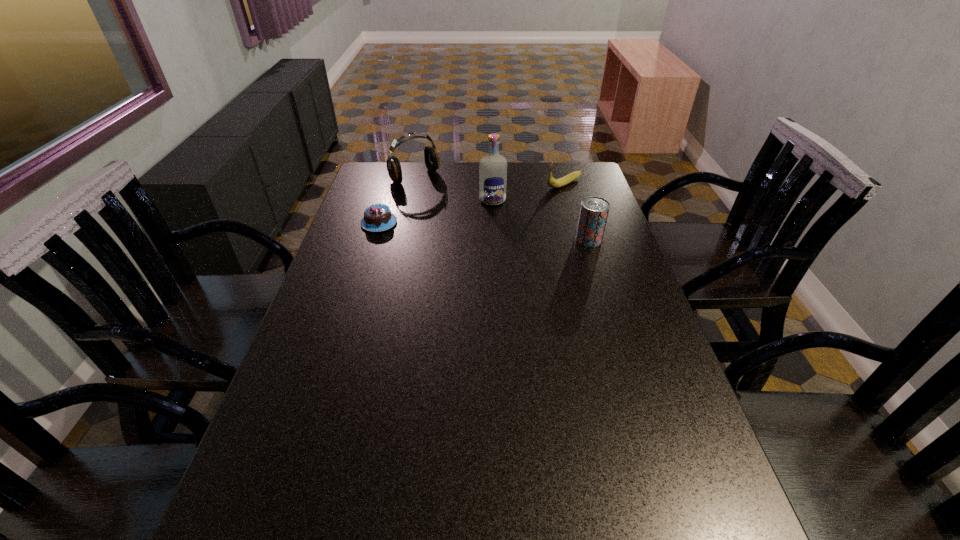
The height and width of the screenshot is (540, 960). Identify the location of free space on the desktop that is between the shortest object and the beer can and is positioned on the ear cups of the headset. (483, 231).

Identify the location of free space on the desktop that is between the chocolate cake and the beer can and is positioned on the label of the third object from right to left. (498, 232).

Locate an element on the screen. The image size is (960, 540). free spot on the desktop that is between the chocolate cake and the beer can and is positioned at the stem of the banana is located at coordinates (460, 230).